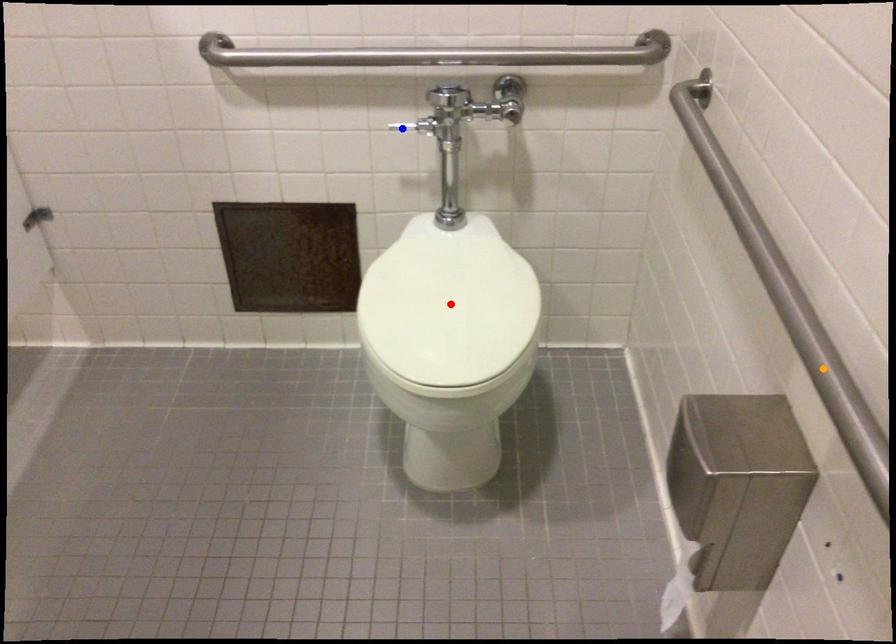
Order these from nearest to farthest:
blue point | orange point | red point

orange point, red point, blue point